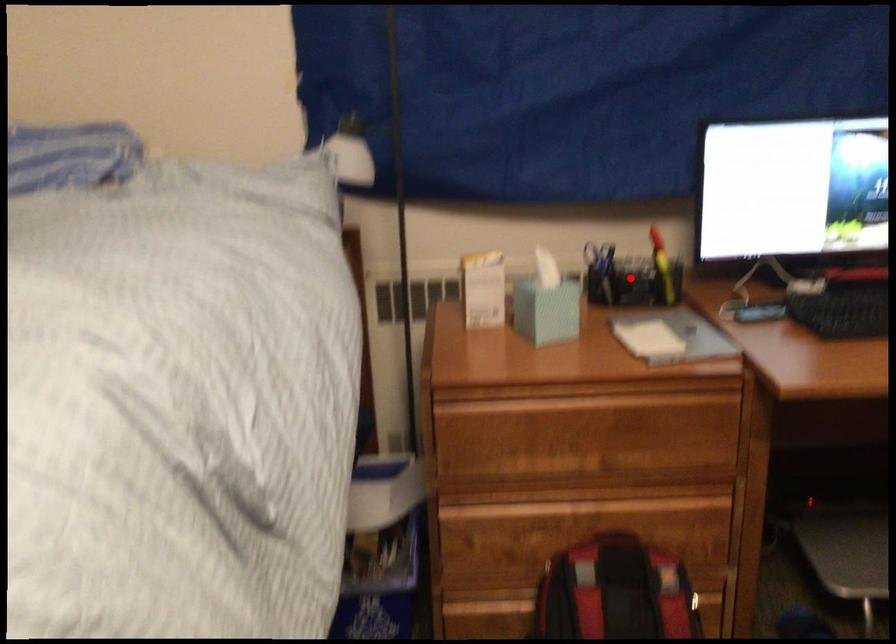
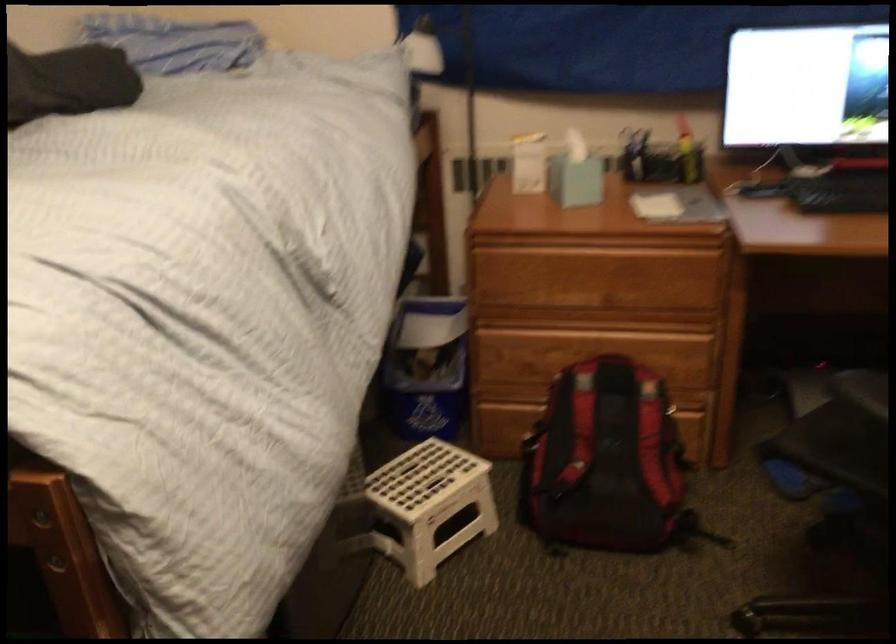
Question: I am providing you with two images of the same scene from different viewpoints. In image1, a red point is highlighted. Considering the same 3D point in image2, which of the following is correct?

Choices:
 (A) It is closer
 (B) It is farther

Answer: (B)